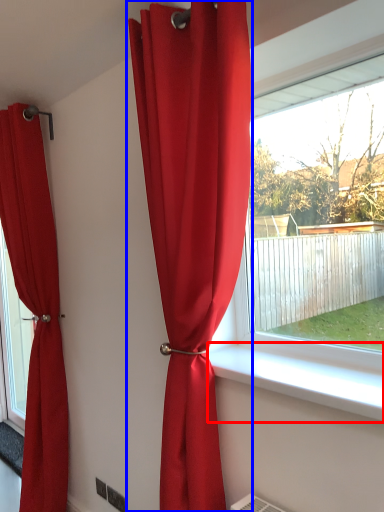
Question: Among these objects, which one is farthest to the camera, window sill (highlighted by a red box) or curtain (highlighted by a blue box)?

Choices:
 (A) window sill
 (B) curtain

Answer: (B)